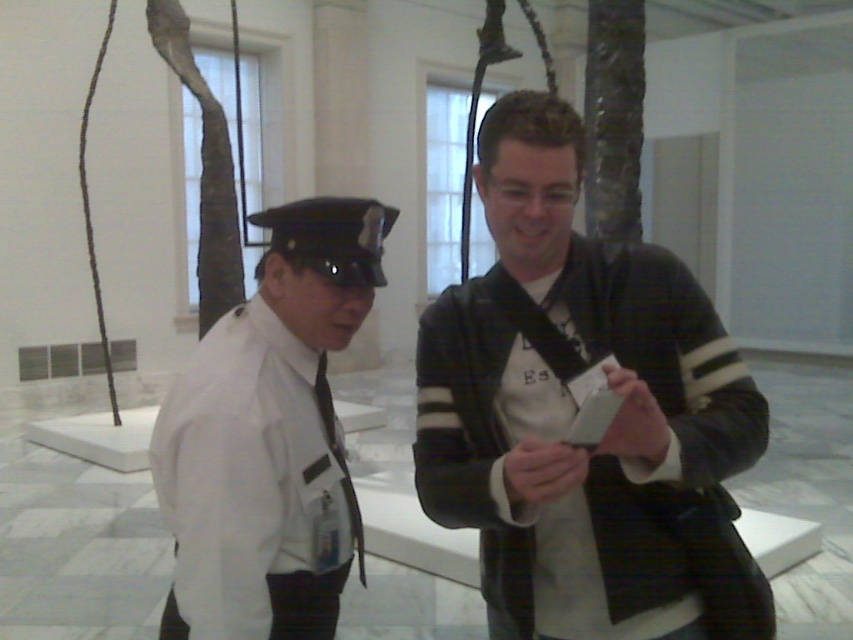
Is black leather jacket at center taller than white smooth shirt at left?

Correct, black leather jacket at center is much taller as white smooth shirt at left.

The image size is (853, 640). Identify the location of black leather jacket at center. point(573,412).

Who is more distant from viewer, (521, 284) or (259, 506)?

Positioned behind is point (521, 284).

You are a GUI agent. You are given a task and a screenshot of the screen. Output one action in this format:
    pyautogui.click(x=<x>, y=<y>)
    Task: Click on the black leather jacket at center
    The width and height of the screenshot is (853, 640).
    Given the screenshot: What is the action you would take?
    pyautogui.click(x=573, y=412)